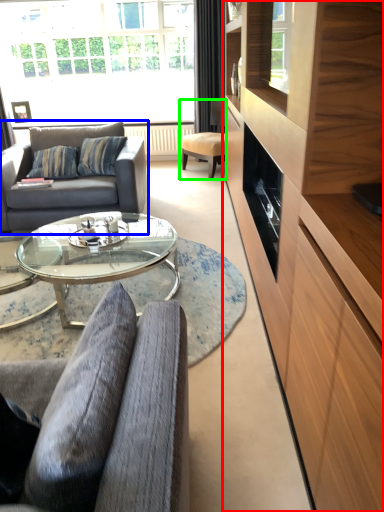
Question: Which is nearer to the cabinetry (highlighted by a red box)? studio couch (highlighted by a blue box) or chair (highlighted by a green box).

Choices:
 (A) studio couch
 (B) chair

Answer: (A)